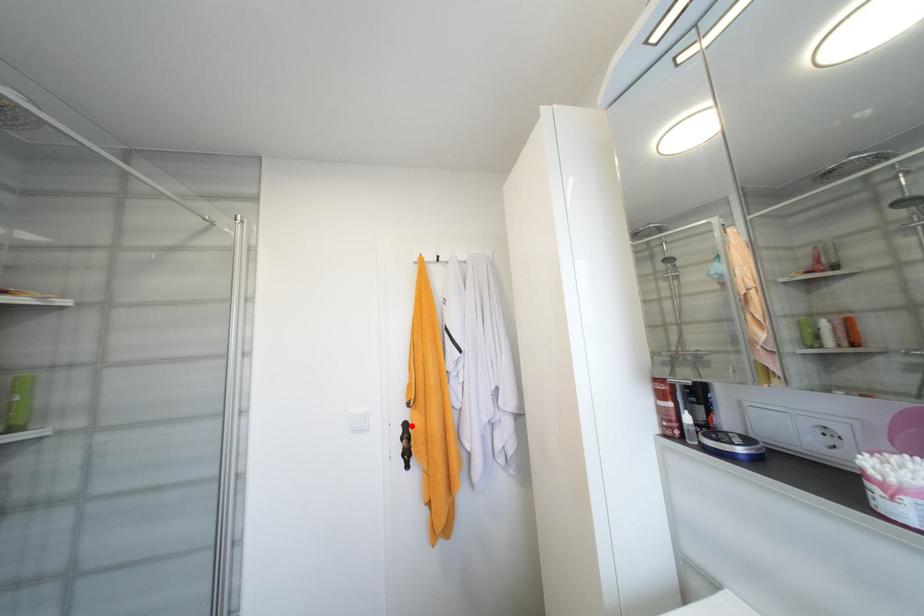
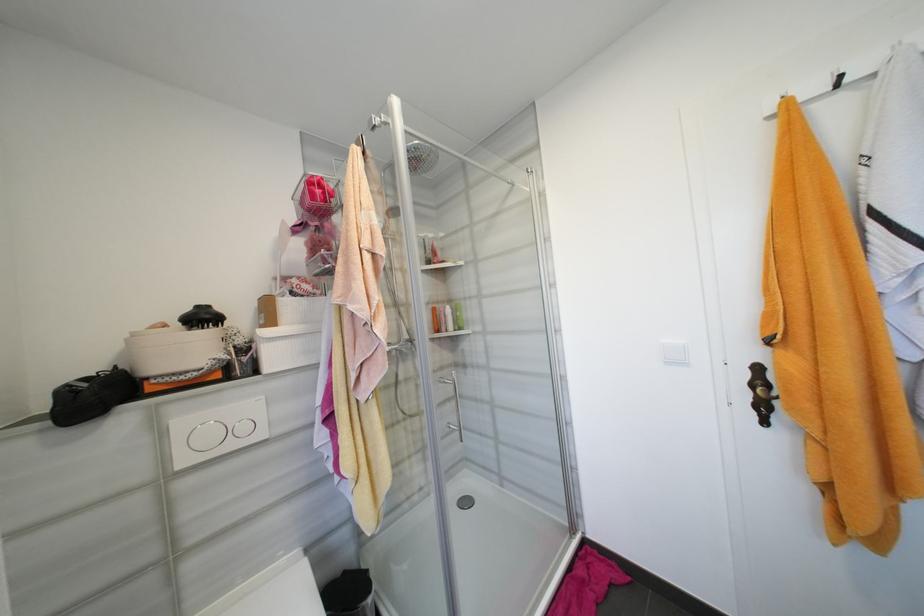
Question: I am providing you with two images of the same scene from different viewpoints. A red point is shown in image1. For the corresponding object point in image2, is it positioned nearer or farther from the camera?

Choices:
 (A) Nearer
 (B) Farther

Answer: (A)